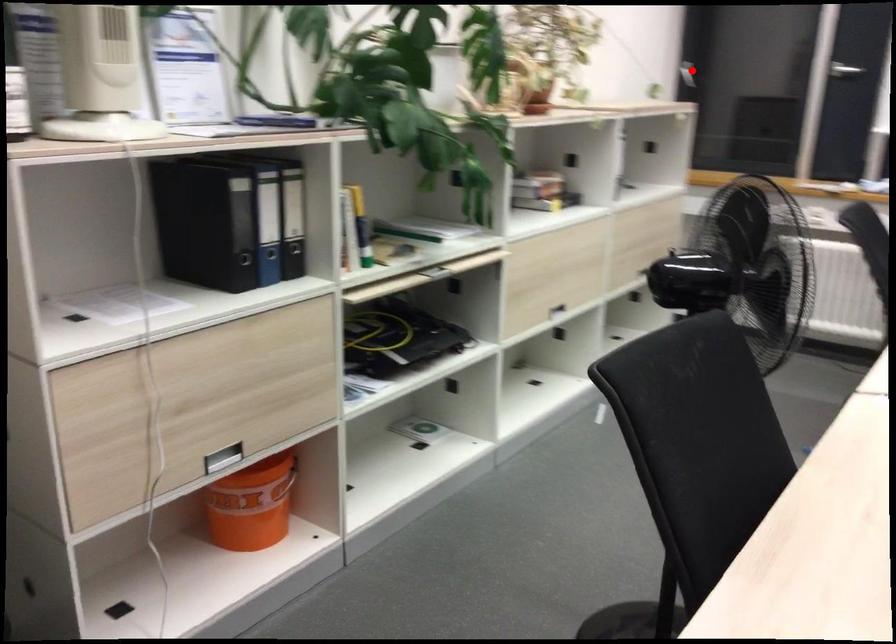
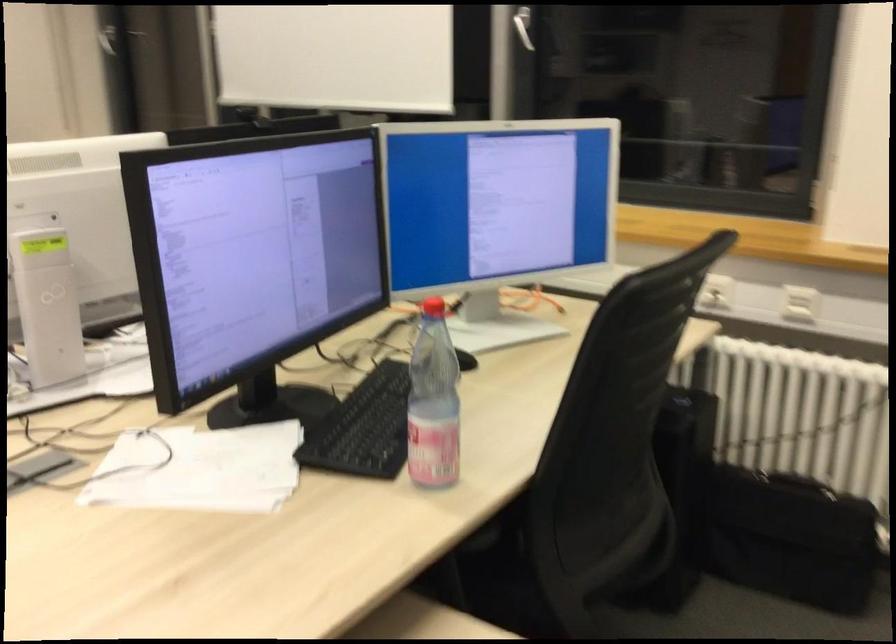
In the second image, find the point that corresponds to the highlighted location in the first image.

(112, 33)